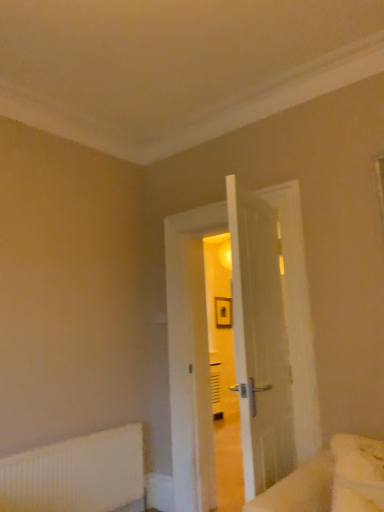
Question: Could you tell me if white wooden door at center is facing white fluffy bed at lower right?

Choices:
 (A) no
 (B) yes

Answer: (A)

Question: From the image's perspective, is white wooden door at center below white fluffy bed at lower right?

Choices:
 (A) yes
 (B) no

Answer: (B)

Question: Is white wooden door at center taller than white fluffy bed at lower right?

Choices:
 (A) yes
 (B) no

Answer: (A)

Question: Is white wooden door at center wider than white fluffy bed at lower right?

Choices:
 (A) no
 (B) yes

Answer: (B)

Question: Is white wooden door at center positioned before white fluffy bed at lower right?

Choices:
 (A) no
 (B) yes

Answer: (A)

Question: Would you say white wooden door at center is a long distance from white fluffy bed at lower right?

Choices:
 (A) no
 (B) yes

Answer: (B)

Question: Is the surface of white ribbed radiator at lower left in direct contact with white wooden door at center?

Choices:
 (A) no
 (B) yes

Answer: (A)

Question: From a real-world perspective, is white ribbed radiator at lower left physically below white wooden door at center?

Choices:
 (A) no
 (B) yes

Answer: (B)

Question: From a real-world perspective, is white ribbed radiator at lower left on white wooden door at center?

Choices:
 (A) yes
 (B) no

Answer: (B)

Question: Is white ribbed radiator at lower left further to camera compared to white wooden door at center?

Choices:
 (A) yes
 (B) no

Answer: (B)

Question: From the image's perspective, does white ribbed radiator at lower left appear lower than white wooden door at center?

Choices:
 (A) no
 (B) yes

Answer: (B)

Question: Can you confirm if white ribbed radiator at lower left is shorter than white wooden door at center?

Choices:
 (A) no
 (B) yes

Answer: (B)

Question: Can you confirm if white fluffy bed at lower right is thinner than white wooden door at center?

Choices:
 (A) no
 (B) yes

Answer: (B)